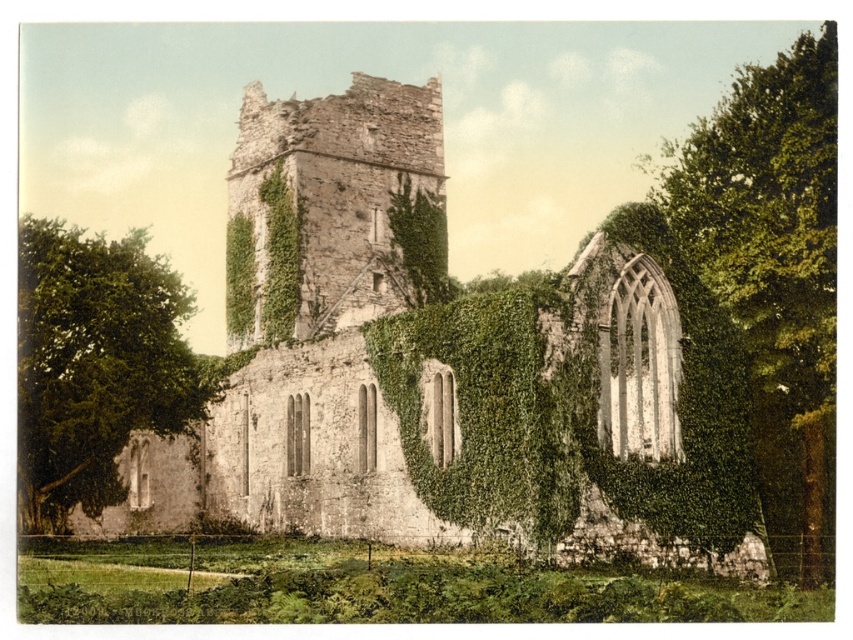
Which of these two, green ivy-covered stone church at center or green leafy tree at left, stands taller?

green ivy-covered stone church at center

Is green ivy-covered stone church at center closer to the viewer compared to green leafy tree at left?

Yes, it is in front of green leafy tree at left.

Locate an element on the screen. The width and height of the screenshot is (853, 640). green ivy-covered stone church at center is located at coordinates (308, 339).

Does green ivy-covered stone church at center have a lesser width compared to green leafy tree at right?

No.

Between point (309, 413) and point (741, 312), which one is positioned behind?

Point (741, 312)

Which is behind, point (358, 106) or point (724, 220)?

Point (358, 106)

Locate an element on the screen. green ivy-covered stone church at center is located at coordinates (308, 339).

Which of these two, green leafy tree at right or green leafy tree at left, stands taller?

With more height is green leafy tree at right.

Is point (809, 380) farther from viewer compared to point (97, 408)?

Yes.

Image resolution: width=853 pixels, height=640 pixels. I want to click on green leafy tree at right, so click(773, 268).